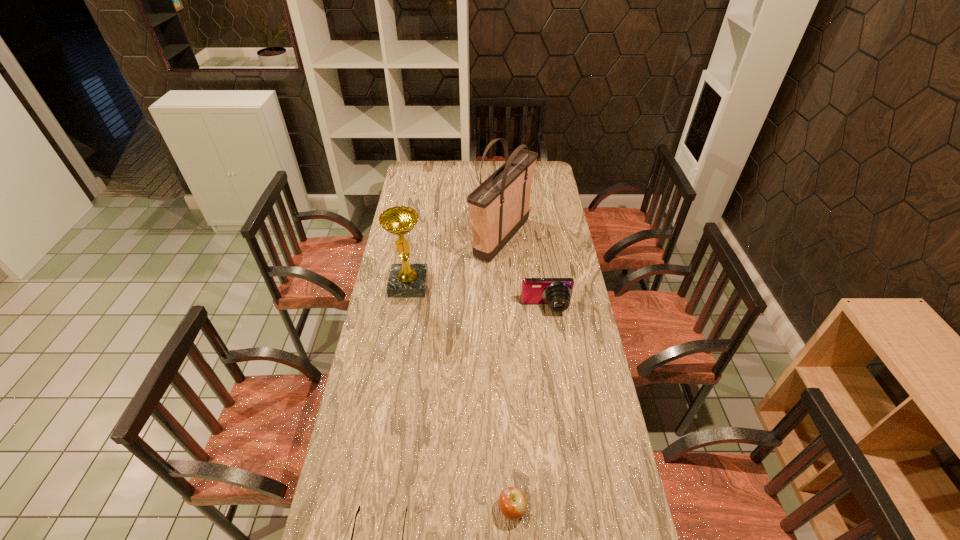
I want to click on shopping bag, so click(x=499, y=207).

Locate an element on the screen. The image size is (960, 540). the tallest object is located at coordinates (499, 207).

Identify the location of award. (406, 280).

The image size is (960, 540). I want to click on the fourth shortest object, so click(x=406, y=280).

Where is `camera`? The width and height of the screenshot is (960, 540). camera is located at coordinates (556, 292).

Identify the location of the third nearest object. The image size is (960, 540). (556, 292).

Find the location of a particular element. This screenshot has width=960, height=540. the fourth tallest object is located at coordinates (513, 503).

Find the location of a particular element. The image size is (960, 540). free location located 0.060m on the front of the shopping bag is located at coordinates (504, 279).

Locate an element on the screen. The image size is (960, 540). free region located on the front-facing side of the second farthest object is located at coordinates (394, 375).

You are a GUI agent. You are given a task and a screenshot of the screen. Output one action in this format:
    pyautogui.click(x=<x>, y=<y>)
    Task: Click on the free location located 0.230m on the front-facing side of the third tallest object
    The width and height of the screenshot is (960, 540).
    Given the screenshot: What is the action you would take?
    pyautogui.click(x=554, y=364)